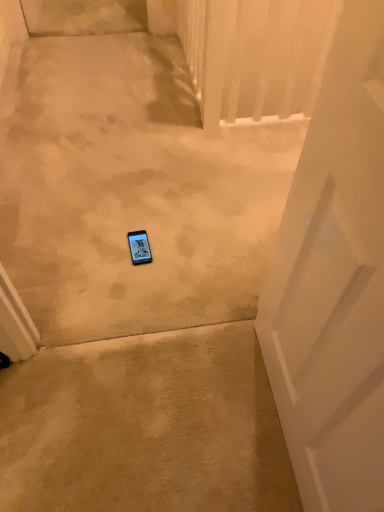
Where is `vacant space in front of matte black phone at center`? This screenshot has height=512, width=384. vacant space in front of matte black phone at center is located at coordinates (132, 285).